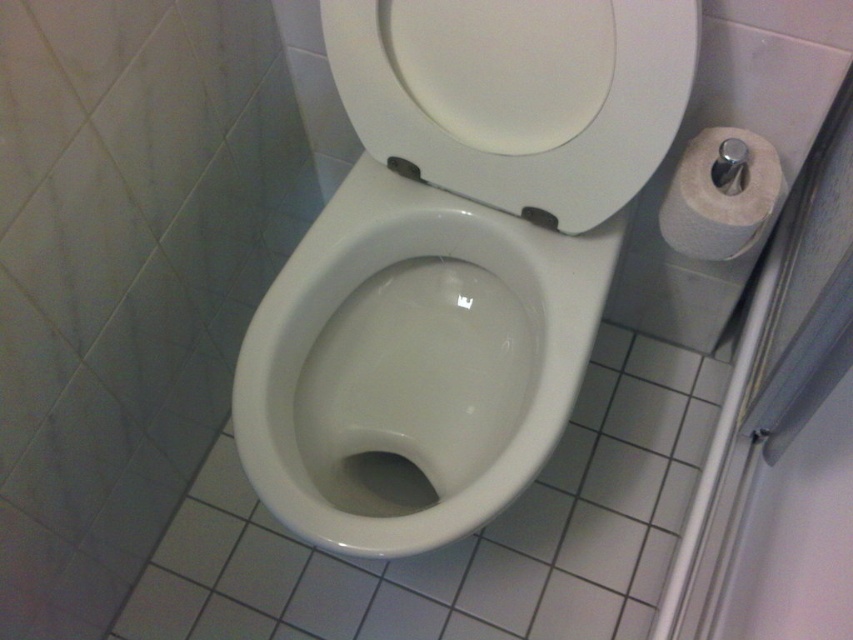
Based on the photo, is white glossy toilet bowl at center to the left of white paper at right from the viewer's perspective?

Yes, white glossy toilet bowl at center is to the left of white paper at right.

Is white glossy toilet bowl at center below white paper at right?

Indeed, white glossy toilet bowl at center is positioned under white paper at right.

Is point (271, 547) behind point (688, 179)?

Yes, point (271, 547) is farther from viewer.

Locate an element on the screen. Image resolution: width=853 pixels, height=640 pixels. white glossy toilet bowl at center is located at coordinates (465, 538).

Is white glossy toilet at center above white paper at right?

No.

Locate an element on the screen. white glossy toilet at center is located at coordinates (454, 257).

Where is `white glossy toilet at center`? This screenshot has width=853, height=640. white glossy toilet at center is located at coordinates (454, 257).

Identify the location of white glossy toilet at center. (454, 257).

Is white glossy toilet bowl at center thinner than white glossy toilet seat at center?

No, white glossy toilet bowl at center is not thinner than white glossy toilet seat at center.

Describe the element at coordinates (465, 538) in the screenshot. I see `white glossy toilet bowl at center` at that location.

Is point (413, 605) farther from camera compared to point (514, 125)?

Yes, point (413, 605) is farther from viewer.

At what (x,y) coordinates should I click in order to perform the action: click on white glossy toilet bowl at center. Please return your answer as a coordinate pair (x, y). Looking at the image, I should click on (465, 538).